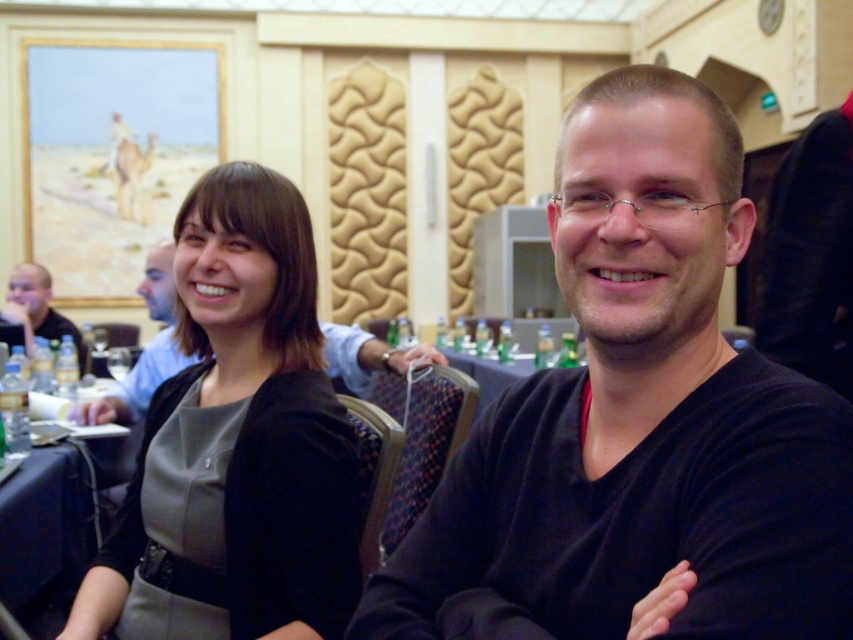
This screenshot has height=640, width=853. Describe the element at coordinates (38, 307) in the screenshot. I see `matte black shirt at left` at that location.

Does matte black shirt at left appear on the left side of matte black shirt at center?

Correct, you'll find matte black shirt at left to the left of matte black shirt at center.

Between point (61, 332) and point (111, 397), which one is positioned in front?

Point (111, 397)

The width and height of the screenshot is (853, 640). Find the location of `matte black shirt at left`. matte black shirt at left is located at coordinates (38, 307).

Can you confirm if black matte shirt at center is positioned below matte black shirt at left?

Yes, black matte shirt at center is below matte black shirt at left.

Is black matte shirt at center positioned at the back of matte black shirt at left?

No, it is not.

Image resolution: width=853 pixels, height=640 pixels. What do you see at coordinates (639, 422) in the screenshot? I see `black matte shirt at center` at bounding box center [639, 422].

The image size is (853, 640). Identify the location of black matte shirt at center. (639, 422).

From the picture: Is black matte shirt at center shorter than matte black jacket at center?

Correct, black matte shirt at center is not as tall as matte black jacket at center.

Can you confirm if black matte shirt at center is wider than matte black jacket at center?

No.

Measure the distance between black matte shirt at center and camera.

black matte shirt at center and camera are 22.26 inches apart.

This screenshot has height=640, width=853. Find the location of `black matte shirt at center`. black matte shirt at center is located at coordinates (639, 422).